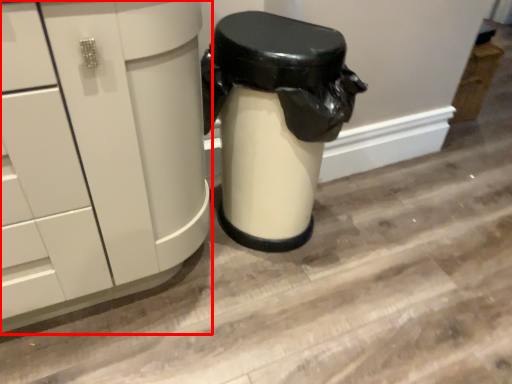
Question: Where is cabinetry (annotated by the red box) located in relation to garbage in the image?

Choices:
 (A) left
 (B) right

Answer: (A)